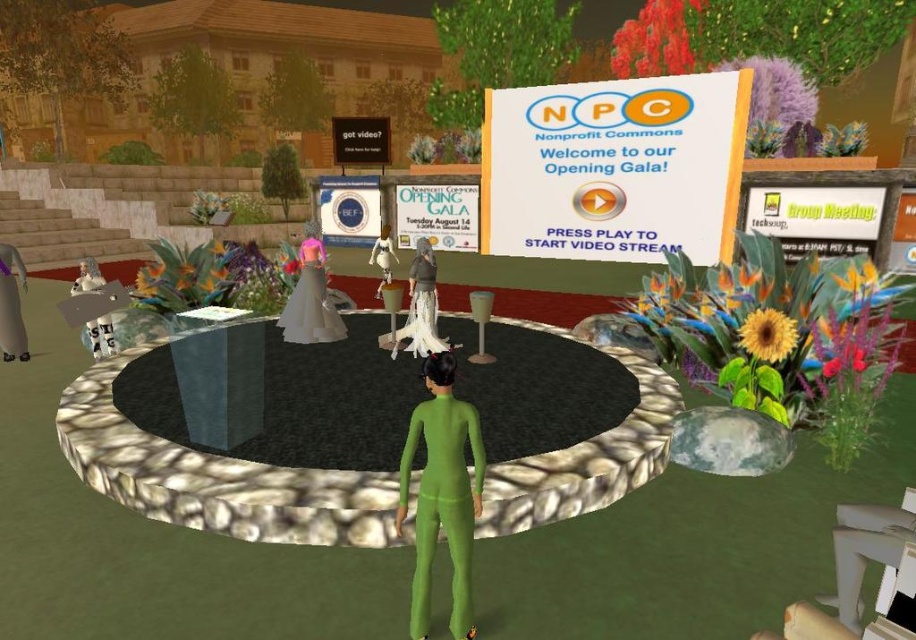
Which is below, green matte/skinny at center or green rubber person at center?

green matte/skinny at center is below.

What do you see at coordinates (442, 492) in the screenshot? Image resolution: width=916 pixels, height=640 pixels. I see `green matte/skinny at center` at bounding box center [442, 492].

Does point (431, 557) come in front of point (14, 289)?

Yes, it is.

This screenshot has height=640, width=916. I want to click on green matte/skinny at center, so click(x=442, y=492).

Based on the photo, which is above, green rubber person at center or white matte dress at center?

white matte dress at center is higher up.

Can you confirm if green rubber person at center is positioned above white matte dress at center?

No.

Which is behind, point (8, 321) or point (390, 282)?

The point (390, 282) is more distant.

At what (x,y) coordinates should I click in order to perform the action: click on green rubber person at center. Please return your answer as a coordinate pair (x, y). This screenshot has width=916, height=640. Looking at the image, I should click on (11, 305).

Which is in front, point (22, 320) or point (86, 291)?

Point (86, 291) is more forward.

Is point (9, 346) positioned behind point (94, 349)?

No, (9, 346) is closer to viewer.

Between point (19, 332) and point (94, 260), which one is positioned behind?

Positioned behind is point (94, 260).

Locate an element on the screen. This screenshot has width=916, height=640. green rubber person at center is located at coordinates (11, 305).